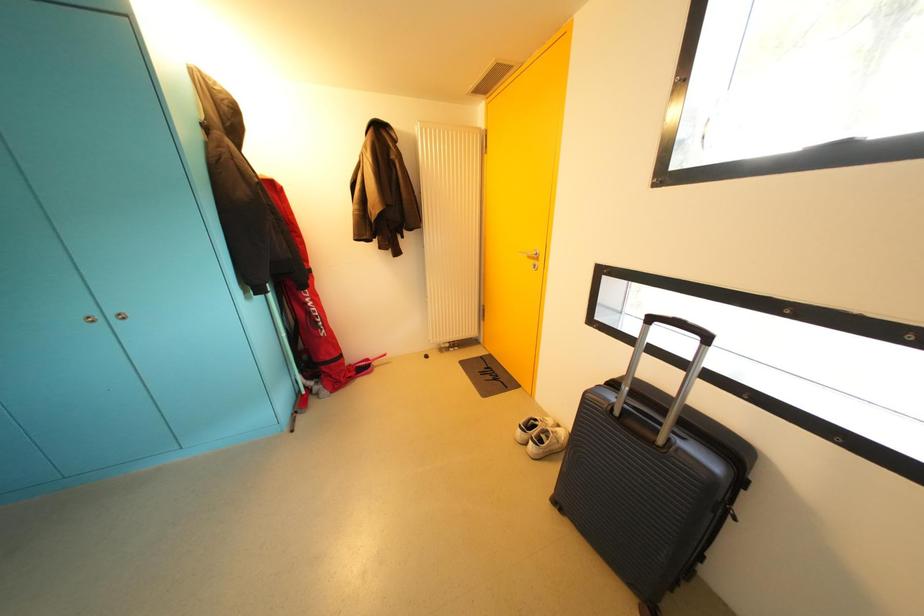
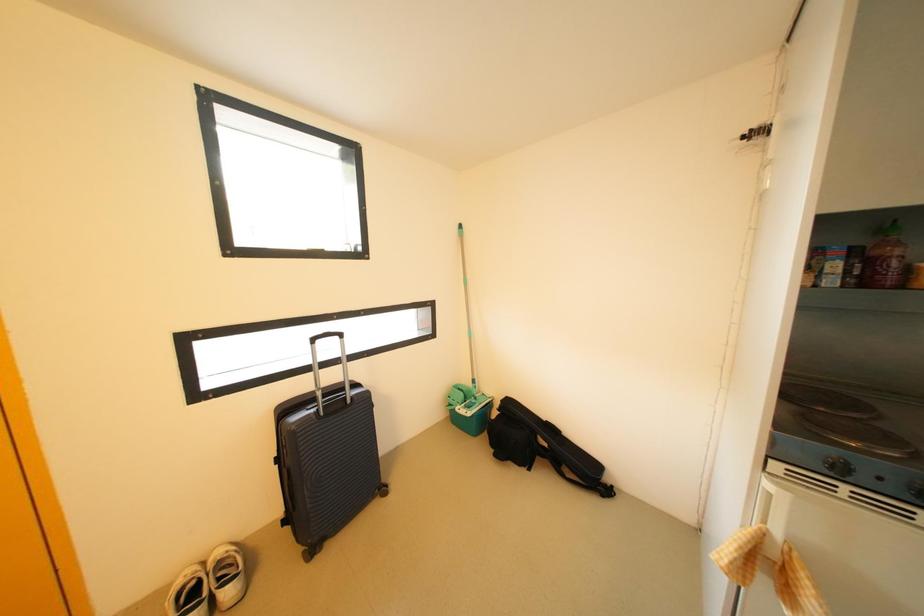
Based on the continuous images, in which direction is the camera rotating?

The rotation direction of the camera is right-down.